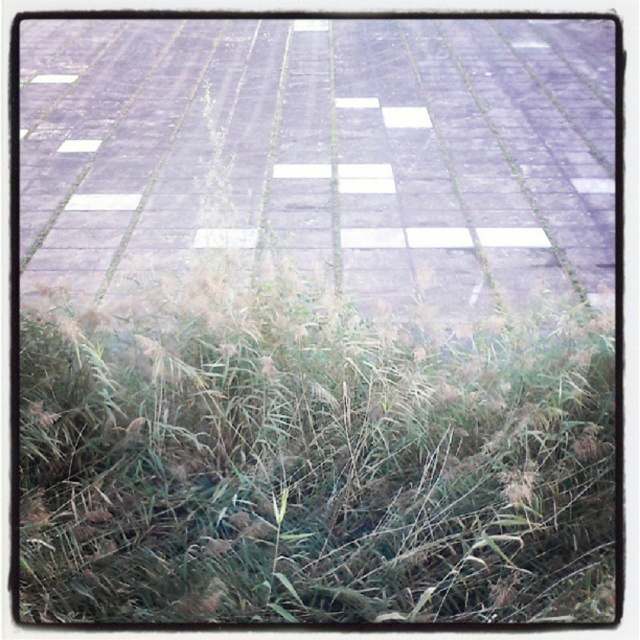
Does green grass at lower left appear on the right side of gray concrete pavement at center?

Indeed, green grass at lower left is positioned on the right side of gray concrete pavement at center.

Does green grass at lower left have a smaller size compared to gray concrete pavement at center?

Correct, green grass at lower left occupies less space than gray concrete pavement at center.

Find the location of a particular element. The height and width of the screenshot is (640, 640). green grass at lower left is located at coordinates (310, 461).

You are a GUI agent. You are given a task and a screenshot of the screen. Output one action in this format:
    pyautogui.click(x=<x>, y=<y>)
    Task: Click on the green grass at lower left
    Image resolution: width=640 pixels, height=640 pixels.
    Given the screenshot: What is the action you would take?
    pyautogui.click(x=310, y=461)